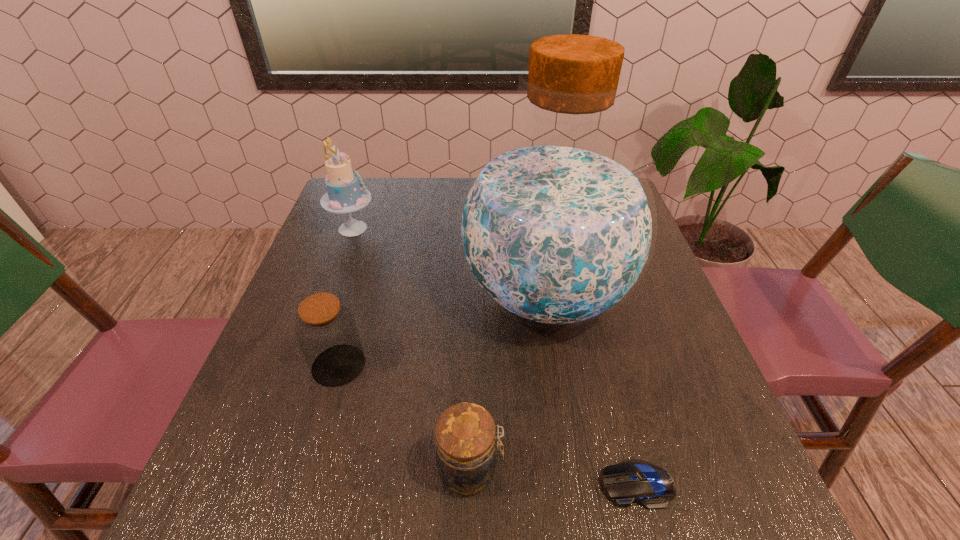
Where is `water jug`? This screenshot has width=960, height=540. water jug is located at coordinates (556, 228).

Identify the location of the fourth shortest object. The width and height of the screenshot is (960, 540). (345, 194).

Identify the location of cake. (345, 194).

In order to click on the left jar in this screenshot , I will do `click(326, 330)`.

The height and width of the screenshot is (540, 960). I want to click on the taller jar, so click(326, 330).

Locate an element on the screen. This screenshot has height=540, width=960. the nearer jar is located at coordinates (465, 435).

Find the location of a particular element. This screenshot has width=960, height=540. the right jar is located at coordinates (465, 435).

What are the coordinates of `computer mouse` in the screenshot? It's located at [x=631, y=481].

Locate an element on the screen. This screenshot has height=540, width=960. vacant area located on the front of the tallest object is located at coordinates (580, 524).

Locate an element on the screen. This screenshot has width=960, height=540. vacant point located with a ladder on the side of the cake is located at coordinates (430, 228).